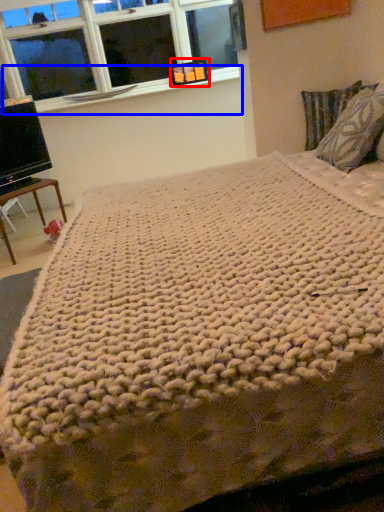
Question: Which object appears farthest to the camera in this image, picture frame (highlighted by a red box) or window sill (highlighted by a blue box)?

Choices:
 (A) picture frame
 (B) window sill

Answer: (A)